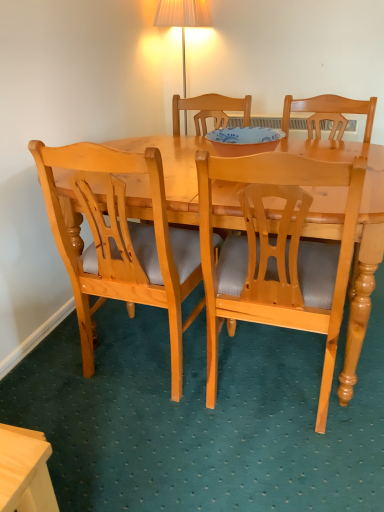
Question: Is blue glossy bowl at center positioned before light brown wood chair at center, which is the first chair in right-to-left order?

Choices:
 (A) yes
 (B) no

Answer: (B)

Question: Is blue glossy bowl at center positioned behind light brown wood chair at center, which is the first chair in right-to-left order?

Choices:
 (A) no
 (B) yes

Answer: (B)

Question: Can you confirm if blue glossy bowl at center is positioned to the right of light brown wood chair at center, which is the first chair in right-to-left order?

Choices:
 (A) no
 (B) yes

Answer: (A)

Question: Could you tell me if blue glossy bowl at center is turned towards light brown wood chair at center, arranged as the second chair when viewed from the left?

Choices:
 (A) yes
 (B) no

Answer: (B)

Question: Does blue glossy bowl at center have a larger size compared to light brown wood chair at center, arranged as the second chair when viewed from the left?

Choices:
 (A) no
 (B) yes

Answer: (A)

Question: Looking at the image, does light brown wood chair at center, arranged as the second chair when viewed from the left, seem bigger or smaller compared to light brown wood chair at left, marked as the first chair in a left-to-right arrangement?

Choices:
 (A) small
 (B) big

Answer: (B)

Question: From the image's perspective, relative to light brown wood chair at left, the 2th chair in the right-to-left sequence, is light brown wood chair at center, which is the first chair in right-to-left order, above or below?

Choices:
 (A) below
 (B) above

Answer: (A)

Question: Is point (321, 180) positioned closer to the camera than point (134, 162)?

Choices:
 (A) farther
 (B) closer

Answer: (B)

Question: Is light brown wood chair at center, which is the first chair in right-to-left order, inside or outside of light brown wood chair at left, marked as the first chair in a left-to-right arrangement?

Choices:
 (A) inside
 (B) outside

Answer: (B)

Question: Looking at their shapes, would you say light wood desk at lower left is wider or thinner than light brown wood chair at left, marked as the first chair in a left-to-right arrangement?

Choices:
 (A) thin
 (B) wide

Answer: (A)

Question: From a real-world perspective, is light wood desk at lower left positioned above or below light brown wood chair at left, the 2th chair in the right-to-left sequence?

Choices:
 (A) above
 (B) below

Answer: (B)

Question: From their relative heights in the image, would you say light wood desk at lower left is taller or shorter than light brown wood chair at left, the 2th chair in the right-to-left sequence?

Choices:
 (A) short
 (B) tall

Answer: (A)

Question: From the image's perspective, is light wood desk at lower left positioned above or below light brown wood chair at left, marked as the first chair in a left-to-right arrangement?

Choices:
 (A) above
 (B) below

Answer: (B)

Question: From the image's perspective, relative to light brown wood chair at center, which is the first chair in right-to-left order, is blue glossy bowl at center above or below?

Choices:
 (A) above
 (B) below

Answer: (A)

Question: From a real-world perspective, is blue glossy bowl at center above or below light brown wood chair at center, which is the first chair in right-to-left order?

Choices:
 (A) above
 (B) below

Answer: (A)